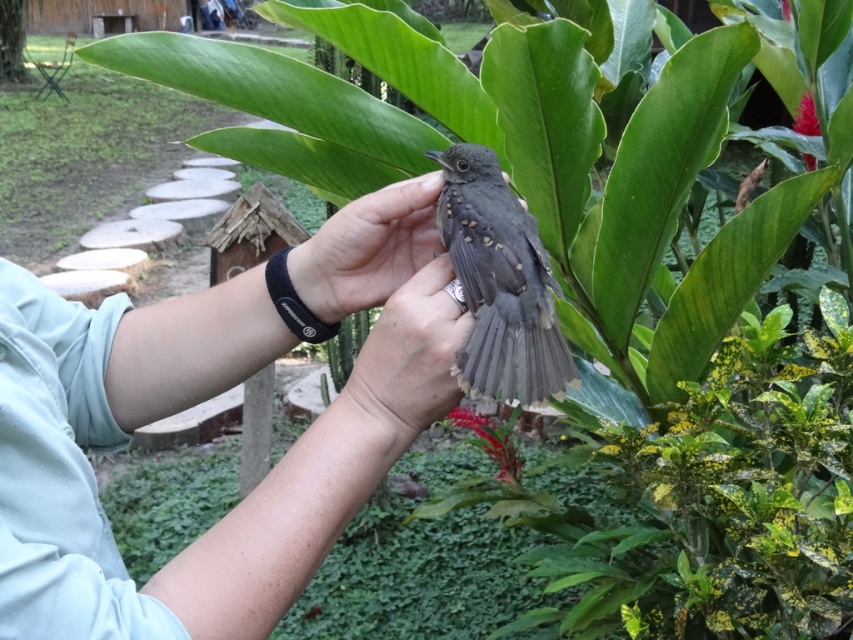
You are a wildlife photographer aiming to capture the bird in the scene. You notice the dark gray feathers at center and the matte gray hand at center. Which object should you focus on if you want to photograph the larger one?

The dark gray feathers at center is larger in size than the matte gray hand at center, so you should focus on the dark gray feathers at center to photograph the larger one.

You are a photographer trying to capture a closeup shot of the dark gray feathers at center. Your camera lens has a minimum focusing distance of 20 inches. Can you take the photo without moving closer than 20 inches?

The dark gray feathers at center and camera are 22.74 inches apart from each other. Since the minimum focusing distance is 20 inches, you can take the photo without moving closer because the current distance of 22.74 inches is within the required range.

In the scene shown: You are a photographer trying to capture the smooth gray bird at center in your shot. The camera is set to focus on the point at coordinates 0.620, 0.249. Will the bird be in focus?

The smooth gray bird at center is located exactly at the point (212, 396), so yes, the bird will be in focus since the camera is set to focus on that exact coordinate.